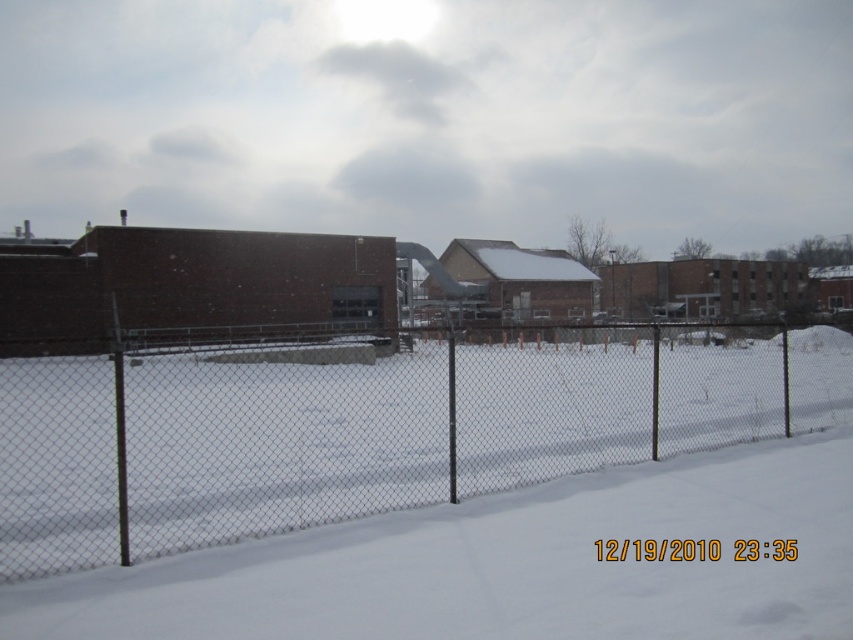
Does wire mesh fence at center have a lesser width compared to white powdery snow at center?

No, wire mesh fence at center is not thinner than white powdery snow at center.

Can you confirm if wire mesh fence at center is wider than white powdery snow at center?

Indeed, wire mesh fence at center has a greater width compared to white powdery snow at center.

In order to click on wire mesh fence at center in this screenshot , I will do `click(372, 428)`.